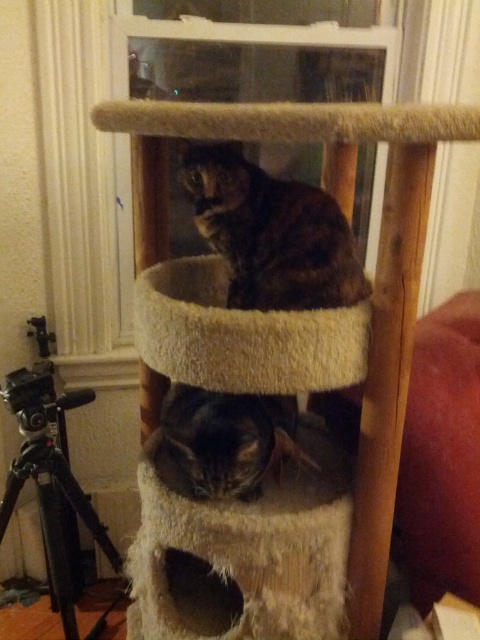
You are standing in front of the cat tree and want to place a treat for the cat on the platform that is closer to you. Which platform should you choose between point (x=391, y=456) and point (x=243, y=348)?

Point (x=243, y=348) is closer to you because point (x=391, y=456) is behind it.

You are standing in front of the cat tree and want to place a new cat bed. The current cat bed is at point (x=241, y=333). Where should you place the new bed so that it is directly above the existing one?

Place the new cat bed at point 0.523, 0.604 to be directly above the existing bed at (x=241, y=333).

You are a cat owner who wants to place a new toy on the cat tree. The toy is 15 inches wide. You have two options to place it either on the fuzzy beige cat bed at center or the dark brown fur at lower center. Based on the cat tree structure, which platform can accommodate the toy?

The fuzzy beige cat bed at center has a greater width than the dark brown fur at lower center, so the toy can be placed on the fuzzy beige cat bed at center since it is wider.